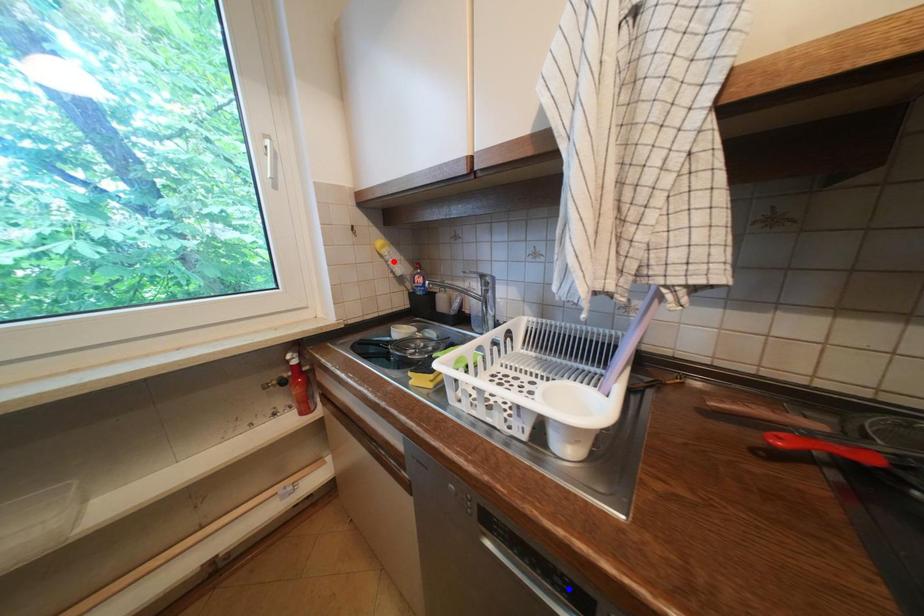
Question: In the image, two points are highlighted. Which point is nearer to the camera? Reply with the corresponding letter.

Choices:
 (A) blue point
 (B) red point

Answer: (A)